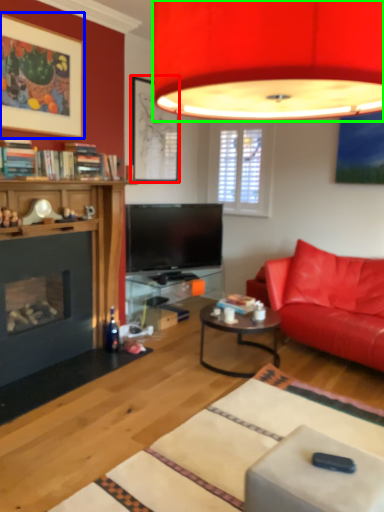
Question: Which object is the closest to the picture frame (highlighted by a red box)? Choose among these: picture frame (highlighted by a blue box) or lamp (highlighted by a green box).

Choices:
 (A) picture frame
 (B) lamp

Answer: (A)